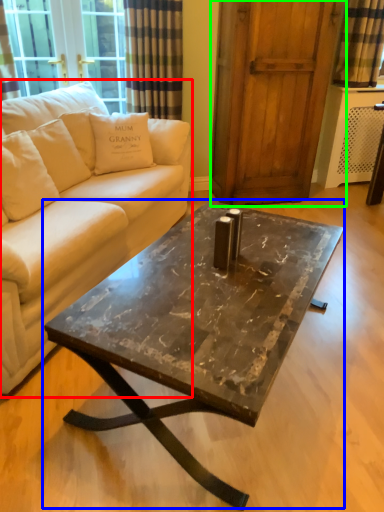
Question: Considering the real-world distances, which object is closest to studio couch (highlighted by a red box)? coffee table (highlighted by a blue box) or screen door (highlighted by a green box).

Choices:
 (A) coffee table
 (B) screen door

Answer: (A)